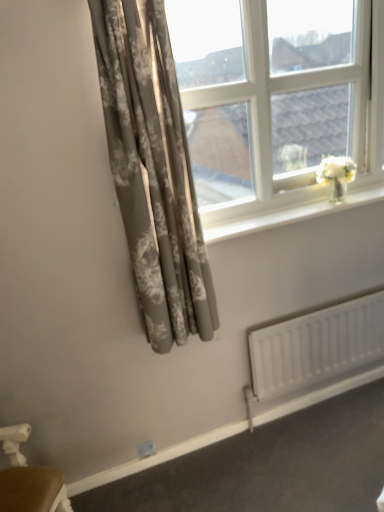
Question: From the image's perspective, does matte gray floral curtain at left appear lower than white glossy window sill at upper center?

Choices:
 (A) no
 (B) yes

Answer: (A)

Question: Is matte gray floral curtain at left located outside white glossy window sill at upper center?

Choices:
 (A) no
 (B) yes

Answer: (B)

Question: Would you say matte gray floral curtain at left contains white glossy window sill at upper center?

Choices:
 (A) no
 (B) yes

Answer: (A)

Question: Can you confirm if matte gray floral curtain at left is smaller than white glossy window sill at upper center?

Choices:
 (A) yes
 (B) no

Answer: (B)

Question: Is matte gray floral curtain at left positioned far away from white glossy window sill at upper center?

Choices:
 (A) no
 (B) yes

Answer: (A)

Question: Relative to clear glass window at upper right, is white matte radiator at lower right in front or behind?

Choices:
 (A) front
 (B) behind

Answer: (B)

Question: Considering the positions of white matte radiator at lower right and clear glass window at upper right in the image, is white matte radiator at lower right taller or shorter than clear glass window at upper right?

Choices:
 (A) tall
 (B) short

Answer: (B)

Question: Is white matte radiator at lower right to the left or to the right of clear glass window at upper right in the image?

Choices:
 (A) right
 (B) left

Answer: (A)

Question: Which is correct: white matte radiator at lower right is inside clear glass window at upper right, or outside of it?

Choices:
 (A) outside
 (B) inside

Answer: (A)

Question: Would you say clear glass window at upper right is inside or outside white glossy window sill at upper center?

Choices:
 (A) inside
 (B) outside

Answer: (B)

Question: In terms of height, does clear glass window at upper right look taller or shorter compared to white glossy window sill at upper center?

Choices:
 (A) short
 (B) tall

Answer: (B)

Question: Considering the positions of clear glass window at upper right and white glossy window sill at upper center in the image, is clear glass window at upper right wider or thinner than white glossy window sill at upper center?

Choices:
 (A) wide
 (B) thin

Answer: (A)

Question: Is clear glass window at upper right bigger or smaller than white glossy window sill at upper center?

Choices:
 (A) big
 (B) small

Answer: (A)

Question: Relative to white matte radiator at lower right, is matte gray floral curtain at left in front or behind?

Choices:
 (A) behind
 (B) front

Answer: (B)

Question: Is matte gray floral curtain at left wider or thinner than white matte radiator at lower right?

Choices:
 (A) wide
 (B) thin

Answer: (A)